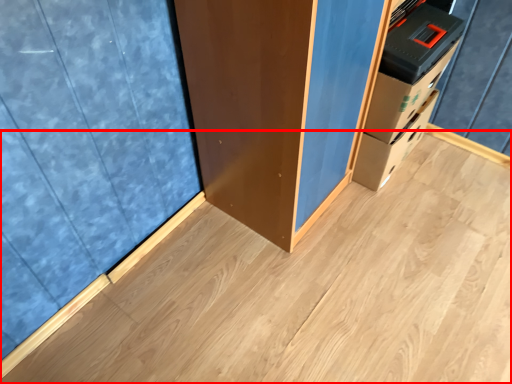
Question: From the image's perspective, what is the correct spatial relationship of plywood (annotated by the red box) in relation to curtain?

Choices:
 (A) above
 (B) below

Answer: (B)